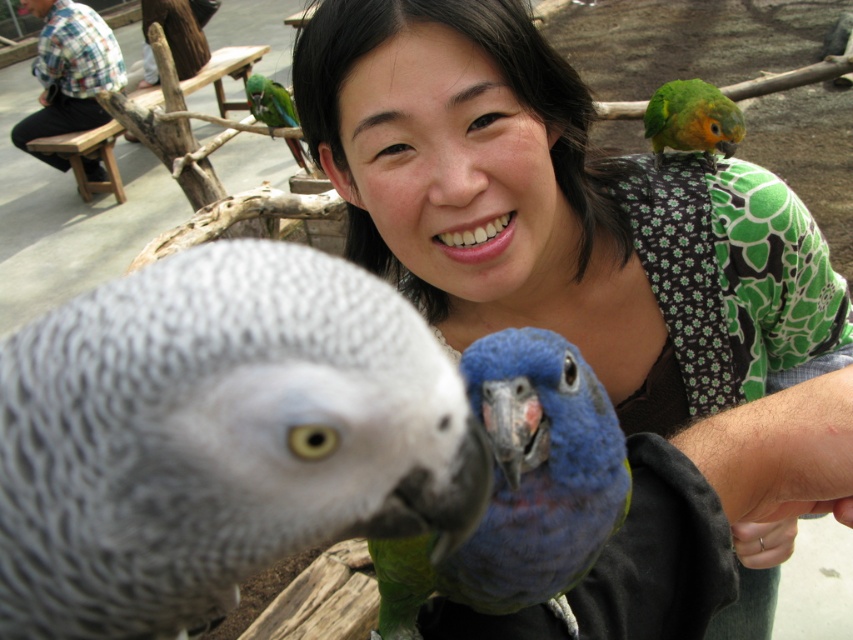
Question: Among these points, which one is farthest from the camera?

Choices:
 (A) (527, 269)
 (B) (749, 556)
 (C) (724, 150)

Answer: (C)

Question: Is blue-green feathered parrot at upper center to the right of silver metallic ring on the right from the viewer's perspective?

Choices:
 (A) yes
 (B) no

Answer: (B)

Question: Is gray matte parrot at center wider than silver metallic ring on the right?

Choices:
 (A) no
 (B) yes

Answer: (B)

Question: Can you confirm if silver metallic ring on the right is bigger than green matte parrot at upper left?

Choices:
 (A) yes
 (B) no

Answer: (B)

Question: Which object is the closest to the green matte parrot at upper right?

Choices:
 (A) blue-green feathered parrot at upper center
 (B) silver metallic ring on the right

Answer: (B)

Question: Which object is the closest to the green matte parrot at upper left?

Choices:
 (A) matte black shirt at upper center
 (B) blue-green feathered parrot at upper center

Answer: (A)